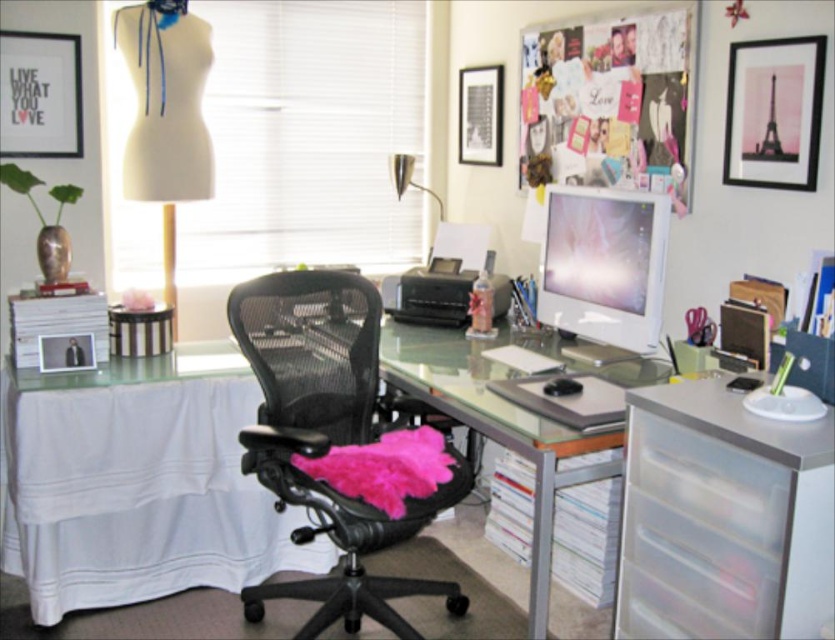
Between clear glass desk at center and black plastic printer at center, which one is positioned lower?

clear glass desk at center is lower down.

Who is more forward, (563, 472) or (426, 273)?

Point (563, 472) is more forward.

Locate an element on the screen. clear glass desk at center is located at coordinates (499, 426).

Is point (626, 380) more distant than point (742, 461)?

Yes, point (626, 380) is farther from viewer.

Can you confirm if clear glass desk at center is positioned to the left of transparent plastic drawer at lower right?

Correct, you'll find clear glass desk at center to the left of transparent plastic drawer at lower right.

Locate an element on the screen. clear glass desk at center is located at coordinates (499, 426).

What are the coordinates of `clear glass desk at center` in the screenshot? It's located at (499, 426).

Which is below, white glossy computer monitor at center or transparent plastic drawer at lower right?

Positioned lower is transparent plastic drawer at lower right.

Can you confirm if white glossy computer monitor at center is smaller than transparent plastic drawer at lower right?

Actually, white glossy computer monitor at center might be larger than transparent plastic drawer at lower right.

Does point (555, 230) come closer to viewer compared to point (629, 429)?

No, (555, 230) is behind (629, 429).

Locate an element on the screen. The height and width of the screenshot is (640, 835). white glossy computer monitor at center is located at coordinates (605, 266).